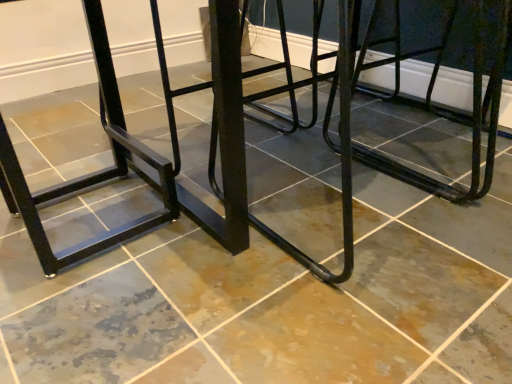
This screenshot has width=512, height=384. Identify the location of free spot in front of black matte metal bar stool at left. (90, 311).